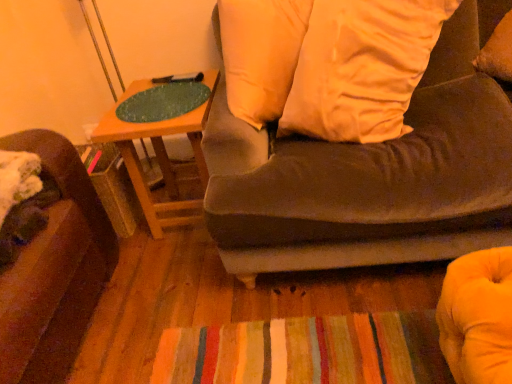
Question: Does wooden table at upper center have a smaller size compared to white soft pillow at upper center?

Choices:
 (A) yes
 (B) no

Answer: (A)

Question: Is wooden table at upper center facing away from white soft pillow at upper center?

Choices:
 (A) yes
 (B) no

Answer: (B)

Question: Is wooden table at upper center touching white soft pillow at upper center?

Choices:
 (A) yes
 (B) no

Answer: (B)

Question: Is wooden table at upper center thinner than white soft pillow at upper center?

Choices:
 (A) no
 (B) yes

Answer: (A)

Question: From the image's perspective, does wooden table at upper center appear lower than white soft pillow at upper center?

Choices:
 (A) yes
 (B) no

Answer: (A)

Question: Is wooden table at upper center far away from white soft pillow at upper center?

Choices:
 (A) yes
 (B) no

Answer: (B)

Question: Does suede-like brown couch at upper right have a larger size compared to white soft pillow at upper center?

Choices:
 (A) no
 (B) yes

Answer: (B)

Question: Is suede-like brown couch at upper right to the right of white soft pillow at upper center from the viewer's perspective?

Choices:
 (A) no
 (B) yes

Answer: (B)

Question: Does suede-like brown couch at upper right have a smaller size compared to white soft pillow at upper center?

Choices:
 (A) no
 (B) yes

Answer: (A)

Question: Is suede-like brown couch at upper right positioned in front of white soft pillow at upper center?

Choices:
 (A) yes
 (B) no

Answer: (A)

Question: Is suede-like brown couch at upper right outside of white soft pillow at upper center?

Choices:
 (A) no
 (B) yes

Answer: (B)

Question: Can you confirm if suede-like brown couch at upper right is wider than white soft pillow at upper center?

Choices:
 (A) yes
 (B) no

Answer: (A)

Question: Considering the relative positions of wooden table at upper center and suede-like brown couch at upper right in the image provided, is wooden table at upper center in front of suede-like brown couch at upper right?

Choices:
 (A) yes
 (B) no

Answer: (B)